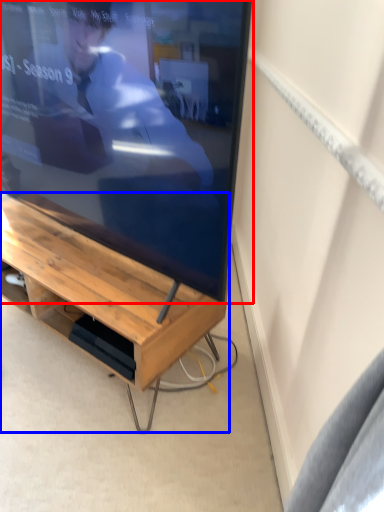
Question: Which point is closer to the camera, television (highlighted by a red box) or desk (highlighted by a blue box)?

Choices:
 (A) television
 (B) desk

Answer: (A)